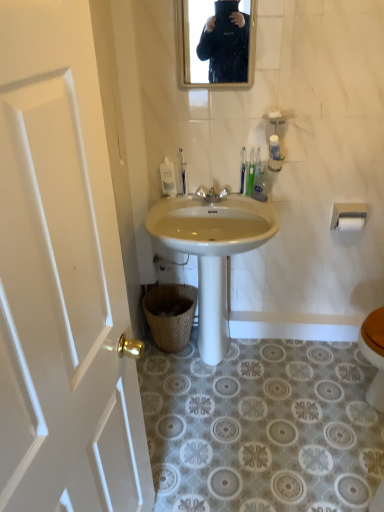
This screenshot has width=384, height=512. Identify the location of vacant area that is situated to the right of white plastic toilet brush at center, which is the first toilet brush in left-to-right order. (210, 200).